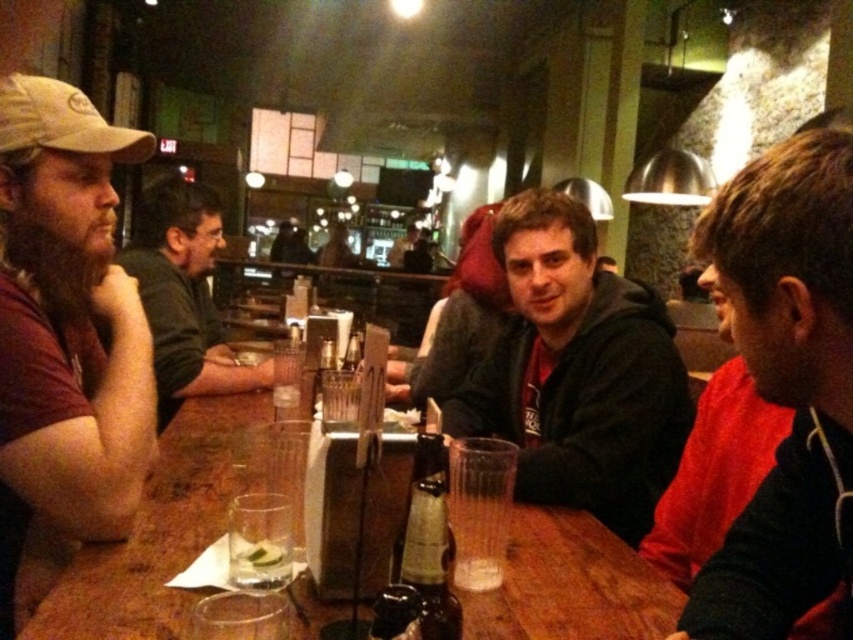
Consider the image. Who is shorter, red matte shirt at right or clear plastic cup at table center?

clear plastic cup at table center is shorter.

Is red matte shirt at right below clear plastic cup at table center?

Actually, red matte shirt at right is above clear plastic cup at table center.

This screenshot has width=853, height=640. I want to click on red matte shirt at right, so click(x=714, y=472).

What are the coordinates of `red matte shirt at right` in the screenshot? It's located at (714, 472).

Is dark brown hair at right shorter than dark gray hoodie at center?

Correct, dark brown hair at right is not as tall as dark gray hoodie at center.

Does dark brown hair at right appear on the left side of dark gray hoodie at center?

Incorrect, dark brown hair at right is not on the left side of dark gray hoodie at center.

I want to click on dark brown hair at right, so click(786, 385).

Between wooden table at center and red matte shirt at right, which one has more height?

red matte shirt at right is taller.

Between wooden table at center and red matte shirt at right, which one appears on the right side from the viewer's perspective?

red matte shirt at right is more to the right.

Where is `wooden table at center`? wooden table at center is located at coordinates (160, 531).